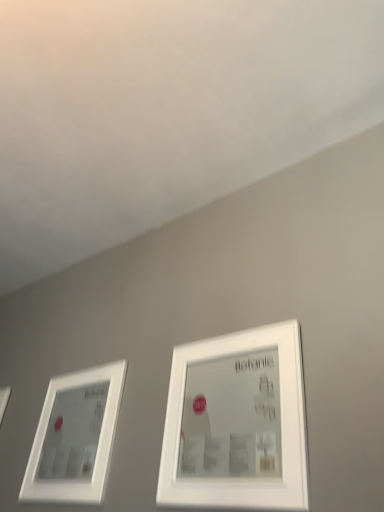
Question: From the image's perspective, is white matte picture frame at center, positioned as the first picture frame in right-to-left order, above white matte picture frame at left, the second picture frame viewed from the right?

Choices:
 (A) yes
 (B) no

Answer: (A)

Question: Is white matte picture frame at center, positioned as the first picture frame in right-to-left order, oriented away from white matte picture frame at left, the second picture frame viewed from the right?

Choices:
 (A) no
 (B) yes

Answer: (A)

Question: Is white matte picture frame at center, positioned as the first picture frame in right-to-left order, further to the viewer compared to white matte picture frame at left, which ranks as the 1th picture frame in left-to-right order?

Choices:
 (A) yes
 (B) no

Answer: (B)

Question: Is white matte picture frame at center, positioned as the first picture frame in right-to-left order, to the right of white matte picture frame at left, which ranks as the 1th picture frame in left-to-right order, from the viewer's perspective?

Choices:
 (A) yes
 (B) no

Answer: (A)

Question: From a real-world perspective, is white matte picture frame at center, the 2th picture frame positioned from the left, located higher than white matte picture frame at left, the second picture frame viewed from the right?

Choices:
 (A) yes
 (B) no

Answer: (B)

Question: Can you confirm if white matte picture frame at center, the 2th picture frame positioned from the left, is shorter than white matte picture frame at left, which ranks as the 1th picture frame in left-to-right order?

Choices:
 (A) no
 (B) yes

Answer: (B)

Question: Considering the relative sizes of white matte picture frame at left, which ranks as the 1th picture frame in left-to-right order, and white matte picture frame at center, positioned as the first picture frame in right-to-left order, in the image provided, is white matte picture frame at left, which ranks as the 1th picture frame in left-to-right order, wider than white matte picture frame at center, positioned as the first picture frame in right-to-left order,?

Choices:
 (A) no
 (B) yes

Answer: (B)

Question: Are white matte picture frame at left, the second picture frame viewed from the right, and white matte picture frame at center, positioned as the first picture frame in right-to-left order, located far from each other?

Choices:
 (A) yes
 (B) no

Answer: (B)

Question: Is white matte picture frame at left, which ranks as the 1th picture frame in left-to-right order, next to white matte picture frame at center, positioned as the first picture frame in right-to-left order, and touching it?

Choices:
 (A) yes
 (B) no

Answer: (B)

Question: Can you confirm if white matte picture frame at left, which ranks as the 1th picture frame in left-to-right order, is positioned to the right of white matte picture frame at center, the 2th picture frame positioned from the left?

Choices:
 (A) yes
 (B) no

Answer: (B)

Question: From the image's perspective, is white matte picture frame at left, which ranks as the 1th picture frame in left-to-right order, located above white matte picture frame at center, positioned as the first picture frame in right-to-left order?

Choices:
 (A) yes
 (B) no

Answer: (B)

Question: Does white matte picture frame at left, the second picture frame viewed from the right, appear on the left side of white matte picture frame at center, positioned as the first picture frame in right-to-left order?

Choices:
 (A) yes
 (B) no

Answer: (A)

Question: Is point (193, 412) positioned closer to the camera than point (124, 365)?

Choices:
 (A) farther
 (B) closer

Answer: (B)